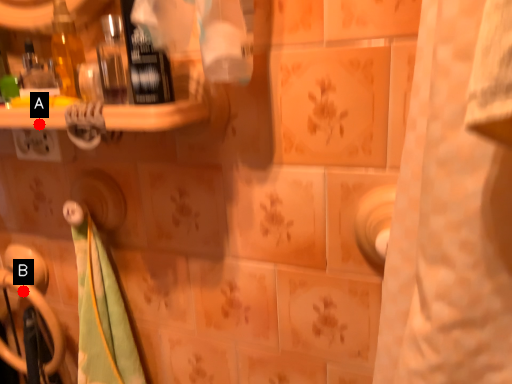
Question: Two points are circled on the image, labeled by A and B beside each circle. Which point appears farthest from the camera in this image?

Choices:
 (A) A is further
 (B) B is further

Answer: (B)